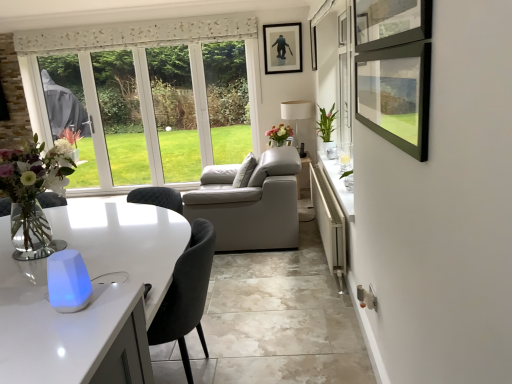
Question: From a real-world perspective, is translucent glass vase at center, which appears as the first flower when viewed from the left, positioned above or below white glossy counter at lower right?

Choices:
 (A) above
 (B) below

Answer: (A)

Question: In the image, is translucent glass vase at center, which appears as the first flower when viewed from the left, on the left side or the right side of white glossy counter at lower right?

Choices:
 (A) right
 (B) left

Answer: (B)

Question: Considering the real-world distances, which object is farthest from the translucent glass vase at left?

Choices:
 (A) matte black picture frame at upper center
 (B) translucent glass vase at center, which is counted as the 2th flower, starting from the front
 (C) white matte lamp at center
 (D) green glossy vase at upper right, placed as the first flower when sorted from front to back
 (E) white glossy counter at lower right

Answer: (C)

Question: Which object is the farthest from the green glossy vase at upper right, the second flower positioned from the left?

Choices:
 (A) white matte lamp at center
 (B) white glossy counter at lower right
 (C) matte black picture frame at upper center
 (D) translucent glass vase at left
 (E) translucent glass vase at center, which ranks as the first flower in back-to-front order

Answer: (D)